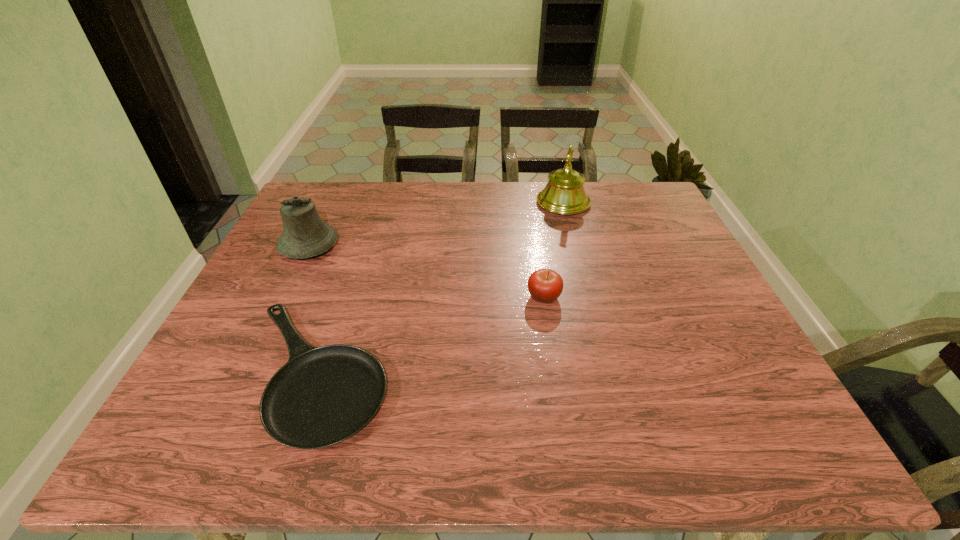
The image size is (960, 540). Identify the location of vacant region between the farthest object and the apple. (554, 249).

You are a GUI agent. You are given a task and a screenshot of the screen. Output one action in this format:
    pyautogui.click(x=<x>, y=<y>)
    Task: Click on the empty space between the second shortest object and the shorter bell
    The height and width of the screenshot is (540, 960).
    Given the screenshot: What is the action you would take?
    pyautogui.click(x=426, y=271)

Locate an element on the screen. The image size is (960, 540). vacant space that is in between the third farthest object and the nearest object is located at coordinates (430, 334).

Locate an element on the screen. The image size is (960, 540). free space between the second shortest object and the frying pan is located at coordinates (430, 334).

Point out which object is positioned as the second nearest to the farthest object. Please provide its 2D coordinates. Your answer should be formatted as a tuple, i.e. [(x, y)], where the tuple contains the x and y coordinates of a point satisfying the conditions above.

[(322, 396)]

Locate which object is the second closest to the left bell. Please provide its 2D coordinates. Your answer should be formatted as a tuple, i.e. [(x, y)], where the tuple contains the x and y coordinates of a point satisfying the conditions above.

[(545, 285)]

This screenshot has width=960, height=540. Identify the location of vacant position in the image that satisfies the following two spatial constraints: 1. on the back side of the tallest object; 2. on the right side of the shorter bell. (x=329, y=202).

This screenshot has height=540, width=960. I want to click on vacant space that satisfies the following two spatial constraints: 1. on the front side of the second tallest object; 2. on the right side of the nearest object, so click(248, 372).

Locate an element on the screen. This screenshot has height=540, width=960. vacant region that satisfies the following two spatial constraints: 1. on the front side of the shortest object; 2. on the right side of the left bell is located at coordinates (248, 372).

Find the location of `vacant space that satisfies the following two spatial constraints: 1. on the back side of the frying pan; 2. on the left side of the right bell`. vacant space that satisfies the following two spatial constraints: 1. on the back side of the frying pan; 2. on the left side of the right bell is located at coordinates (374, 202).